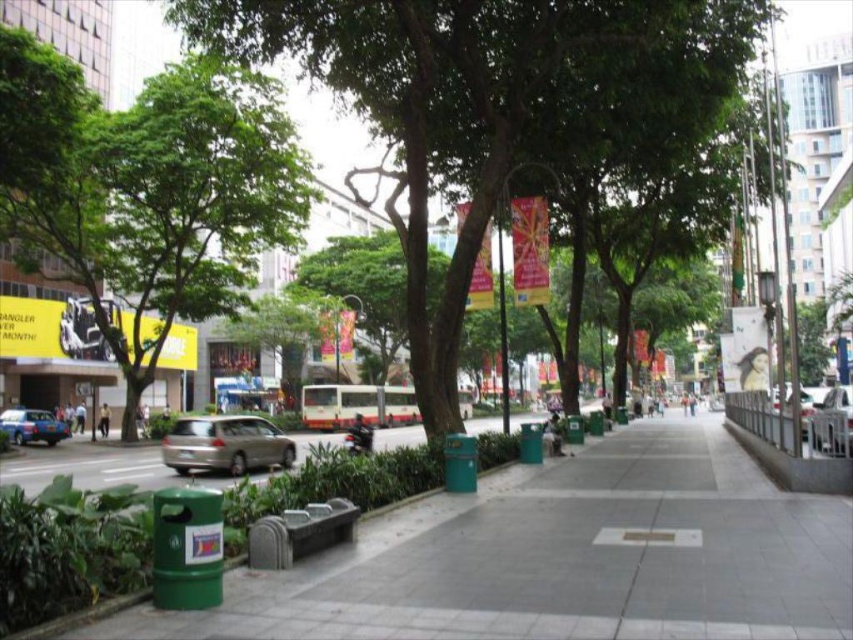
Does green leafy tree at left appear on the right side of satin silver car at center-right?

In fact, green leafy tree at left is to the left of satin silver car at center-right.

Is the position of green leafy tree at left more distant than that of satin silver car at center-right?

Yes, it is behind satin silver car at center-right.

What do you see at coordinates (149, 189) in the screenshot? This screenshot has width=853, height=640. I see `green leafy tree at left` at bounding box center [149, 189].

Find the location of a particular element. The image size is (853, 640). green leafy tree at left is located at coordinates (149, 189).

Describe the element at coordinates (833, 420) in the screenshot. I see `satin silver car at center-right` at that location.

Consider the image. Is satin silver car at center-right thinner than blue metallic car at left?

In fact, satin silver car at center-right might be wider than blue metallic car at left.

Which is in front, point (845, 449) or point (33, 412)?

Point (845, 449) is more forward.

Locate an element on the screen. satin silver car at center-right is located at coordinates (833, 420).

Can you confirm if green leafy tree at center is shorter than satin silver car at center-right?

No.

Does green leafy tree at center appear on the right side of satin silver car at center-right?

In fact, green leafy tree at center is to the left of satin silver car at center-right.

Where is `green leafy tree at center`? green leafy tree at center is located at coordinates (498, 108).